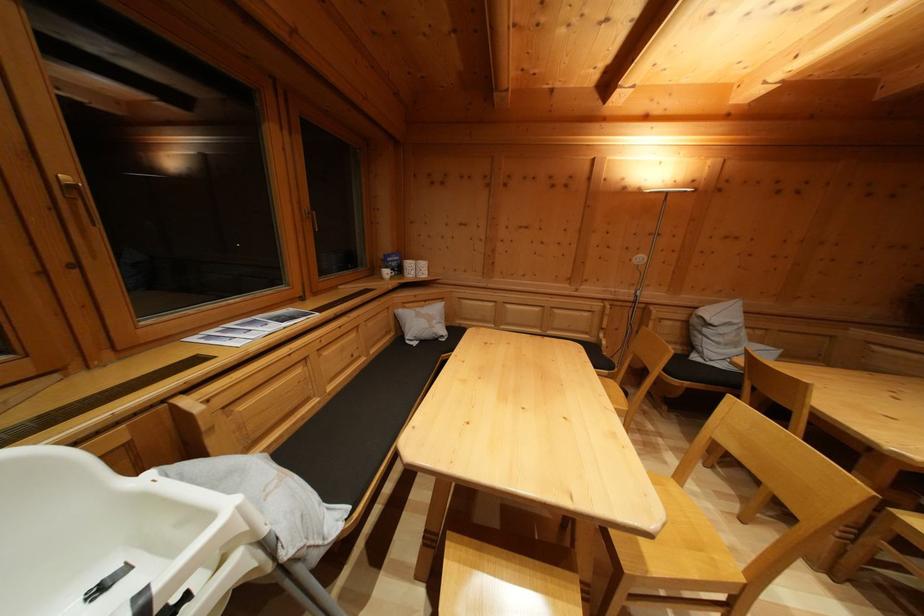
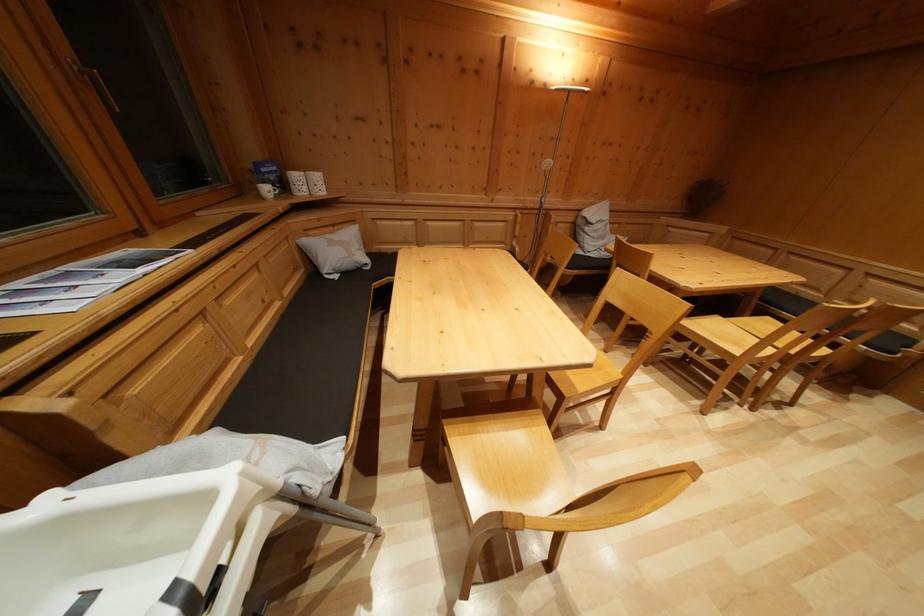
Question: What movement of the cameraman would produce the second image?

Choices:
 (A) Left
 (B) Right
 (C) Forward
 (D) Backward

Answer: (A)